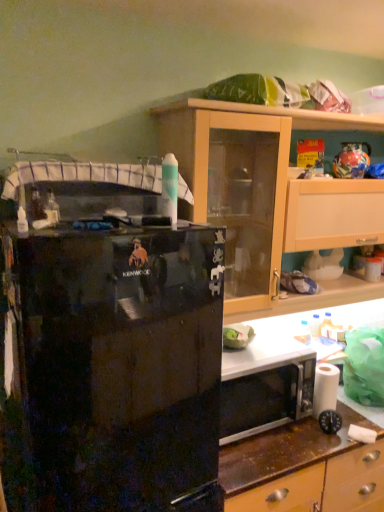
Question: Does light wood cabinet at upper right lie behind black glossy refrigerator at left?

Choices:
 (A) yes
 (B) no

Answer: (A)

Question: Is light wood cabinet at upper right not within black glossy refrigerator at left?

Choices:
 (A) yes
 (B) no

Answer: (A)

Question: Is light wood cabinet at upper right placed right next to black glossy refrigerator at left?

Choices:
 (A) yes
 (B) no

Answer: (B)

Question: Considering the relative sizes of light wood cabinet at upper right and black glossy refrigerator at left in the image provided, is light wood cabinet at upper right shorter than black glossy refrigerator at left?

Choices:
 (A) yes
 (B) no

Answer: (A)

Question: Is black glossy refrigerator at left at the back of light wood cabinet at upper right?

Choices:
 (A) yes
 (B) no

Answer: (B)

Question: Can you confirm if light wood cabinet at upper right is smaller than black glossy refrigerator at left?

Choices:
 (A) yes
 (B) no

Answer: (A)

Question: Is the surface of white matte toilet paper at lower right in direct contact with light wood cabinet at upper right?

Choices:
 (A) yes
 (B) no

Answer: (B)

Question: Is white matte toilet paper at lower right to the right of light wood cabinet at upper right from the viewer's perspective?

Choices:
 (A) yes
 (B) no

Answer: (A)

Question: From the image's perspective, is white matte toilet paper at lower right above light wood cabinet at upper right?

Choices:
 (A) no
 (B) yes

Answer: (A)

Question: Is white matte toilet paper at lower right not inside light wood cabinet at upper right?

Choices:
 (A) yes
 (B) no

Answer: (A)

Question: Is light wood cabinet at upper right surrounded by white matte toilet paper at lower right?

Choices:
 (A) no
 (B) yes

Answer: (A)

Question: Can you confirm if white matte toilet paper at lower right is shorter than light wood cabinet at upper right?

Choices:
 (A) yes
 (B) no

Answer: (A)

Question: Does black glossy refrigerator at left have a lesser width compared to light wood cabinet at upper right?

Choices:
 (A) no
 (B) yes

Answer: (A)